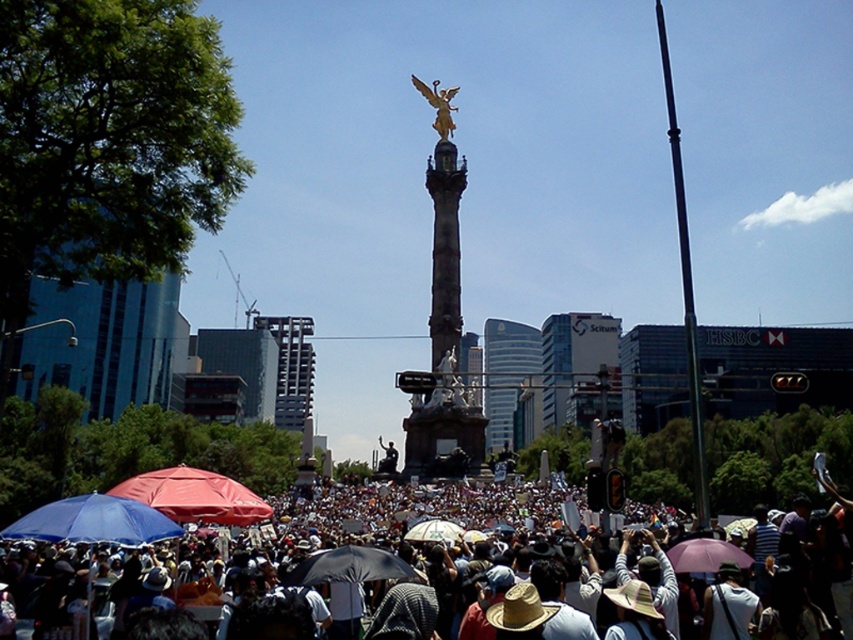
Question: Which object is positioned farthest from the white cotton crowd at center?

Choices:
 (A) white fabric umbrella at center
 (B) glassy blue skyscraper at center
 (C) gold polished statue at center

Answer: (B)

Question: Which object appears closest to the camera in this image?

Choices:
 (A) purple matte umbrella at center
 (B) white fabric umbrella at center

Answer: (A)

Question: Can you confirm if white cotton crowd at center is positioned below glassy concrete skyscraper at center?

Choices:
 (A) no
 (B) yes

Answer: (B)

Question: Is white cotton crowd at center positioned at the back of white fabric umbrella at center?

Choices:
 (A) yes
 (B) no

Answer: (B)

Question: Does gold polished statue at center come behind matte blue umbrella at lower left?

Choices:
 (A) yes
 (B) no

Answer: (A)

Question: Considering the real-world distances, which object is farthest from the gold metallic eagle at center?

Choices:
 (A) gold polished statue at center
 (B) glassy blue skyscraper at center
 (C) matte blue umbrella at lower left
 (D) white cotton crowd at center

Answer: (C)